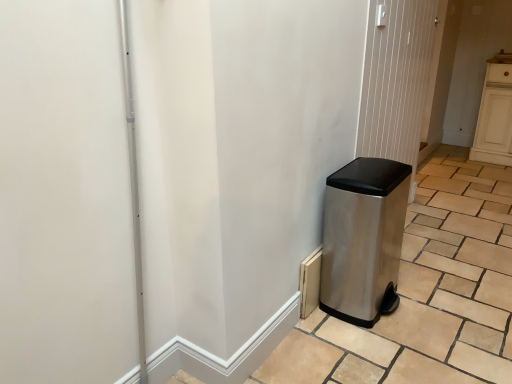
Describe the element at coordinates (396, 79) in the screenshot. The image size is (512, 384). I see `stainless steel trash can at right` at that location.

I want to click on stainless steel trash can at right, so click(396, 79).

The image size is (512, 384). What do you see at coordinates (362, 238) in the screenshot?
I see `stainless steel trash can at right` at bounding box center [362, 238].

This screenshot has width=512, height=384. I want to click on stainless steel trash can at right, so click(x=396, y=79).

From a real-world perspective, is stainless steel trash can at right below stainless steel trash can at right?

Yes.

Considering the sizes of stainless steel trash can at right and stainless steel trash can at right in the image, is stainless steel trash can at right bigger or smaller than stainless steel trash can at right?

In the image, stainless steel trash can at right appears to be larger than stainless steel trash can at right.

Would you consider stainless steel trash can at right to be distant from stainless steel trash can at right?

stainless steel trash can at right is actually quite close to stainless steel trash can at right.

Between point (325, 287) and point (400, 95), which one is positioned in front?

The point (325, 287) is more forward.

Looking at this image, is stainless steel trash can at right at the back of satin silver trash can at right?

satin silver trash can at right does not have its back to stainless steel trash can at right.

Can you see satin silver trash can at right touching stainless steel trash can at right?

They are not placed beside each other.

How different are the orientations of satin silver trash can at right and stainless steel trash can at right in degrees?

satin silver trash can at right and stainless steel trash can at right are facing 88.2 degrees away from each other.

Would you say stainless steel trash can at right is part of satin silver trash can at right's contents?

No, stainless steel trash can at right is not a part of satin silver trash can at right.

In terms of height, does satin silver trash can at right look taller or shorter compared to stainless steel trash can at right?

Considering their sizes, satin silver trash can at right has less height than stainless steel trash can at right.

From a real-world perspective, is satin silver trash can at right physically located above or below stainless steel trash can at right?

satin silver trash can at right is situated lower than stainless steel trash can at right in the real world.

At what (x,y) coordinates should I click in order to perform the action: click on tile in front of the stainless steel trash can at right. Please return your answer as a coordinate pair (x, y). Looking at the image, I should click on (426, 293).

How distant is stainless steel trash can at right from satin silver trash can at right?

They are 34.40 inches apart.

Can you confirm if stainless steel trash can at right is positioned to the right of satin silver trash can at right?

No.

From a real-world perspective, is stainless steel trash can at right physically located above or below satin silver trash can at right?

In terms of real-world spatial position, stainless steel trash can at right is above satin silver trash can at right.

You are a GUI agent. You are given a task and a screenshot of the screen. Output one action in this format:
    pyautogui.click(x=<x>, y=<y>)
    Task: Click on the tile below the stainless steel trash can at right (from a real-world perspective)
    The height and width of the screenshot is (384, 512).
    Given the screenshot: What is the action you would take?
    pyautogui.click(x=426, y=293)

Which object is positioned more to the right, stainless steel trash can at right or satin silver trash can at right?

Positioned to the right is satin silver trash can at right.

Does stainless steel trash can at right have a larger size compared to satin silver trash can at right?

Incorrect, stainless steel trash can at right is not larger than satin silver trash can at right.

Looking at their sizes, would you say stainless steel trash can at right is wider or thinner than satin silver trash can at right?

In the image, stainless steel trash can at right appears to be more narrow than satin silver trash can at right.

Could stainless steel trash can at right be considered to be inside stainless steel trash can at right?

Actually, stainless steel trash can at right is outside stainless steel trash can at right.

Is stainless steel trash can at right not near stainless steel trash can at right?

No, stainless steel trash can at right is not far away from stainless steel trash can at right.

From the image's perspective, between stainless steel trash can at right and stainless steel trash can at right, which one is located above?

From the image's view, stainless steel trash can at right is above.

Between stainless steel trash can at right and stainless steel trash can at right, which one has larger size?

stainless steel trash can at right.

Locate an element on the screen. The width and height of the screenshot is (512, 384). waste container in front of the stainless steel trash can at right is located at coordinates (362, 238).

Locate an element on the screen. waste container above the satin silver trash can at right (from the image's perspective) is located at coordinates (362, 238).

When comparing their distances from stainless steel trash can at right, does satin silver trash can at right or stainless steel trash can at right seem closer?

The object closer to stainless steel trash can at right is satin silver trash can at right.

Looking at the image, which one is located further to stainless steel trash can at right, stainless steel trash can at right or satin silver trash can at right?

satin silver trash can at right.

Based on their spatial positions, is stainless steel trash can at right or stainless steel trash can at right further from satin silver trash can at right?

Based on the image, stainless steel trash can at right appears to be further to satin silver trash can at right.

Which object lies further to the anchor point stainless steel trash can at right, satin silver trash can at right or stainless steel trash can at right?

satin silver trash can at right is positioned further to the anchor stainless steel trash can at right.

Looking at the image, which one is located closer to stainless steel trash can at right, stainless steel trash can at right or satin silver trash can at right?

Among the two, satin silver trash can at right is located nearer to stainless steel trash can at right.

Considering their positions, is stainless steel trash can at right positioned closer to satin silver trash can at right than stainless steel trash can at right?

stainless steel trash can at right lies closer to satin silver trash can at right than the other object.

The width and height of the screenshot is (512, 384). What are the coordinates of `waste container located between satin silver trash can at right and stainless steel trash can at right in the depth direction` in the screenshot? It's located at (362, 238).